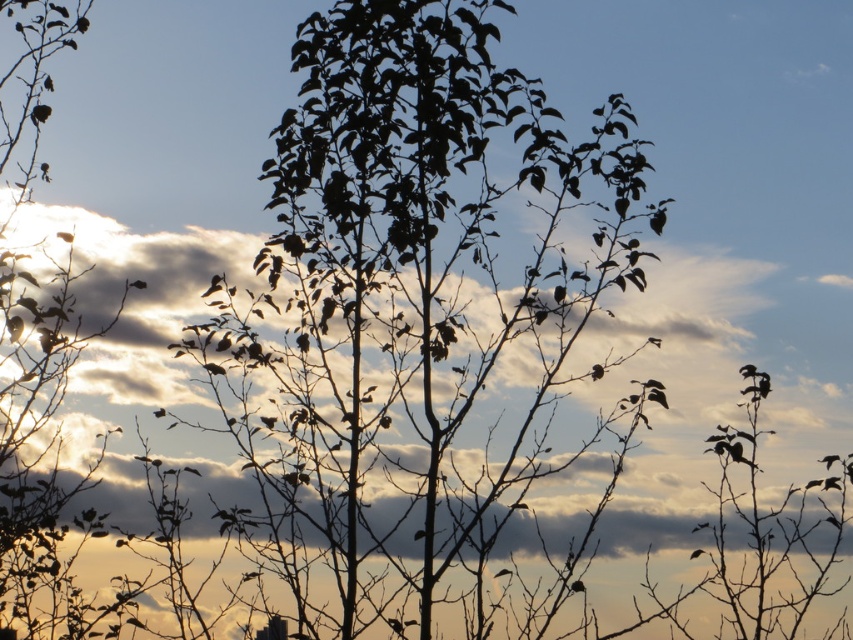
Question: Which of the following is the closest to the observer?

Choices:
 (A) silhouette leafy tree at center
 (B) white fluffy cloud at upper center

Answer: (A)

Question: Which of the following is the closest to the observer?

Choices:
 (A) white fluffy cloud at upper center
 (B) silhouette leafy tree at center

Answer: (B)

Question: Which point appears closest to the camera in this image?

Choices:
 (A) (674, 358)
 (B) (614, 177)

Answer: (B)

Question: Can you confirm if silhouette leafy tree at center is positioned above white fluffy cloud at upper center?

Choices:
 (A) yes
 (B) no

Answer: (A)

Question: Is silhouette leafy tree at center thinner than white fluffy cloud at upper center?

Choices:
 (A) yes
 (B) no

Answer: (B)

Question: Can you confirm if silhouette leafy tree at center is wider than white fluffy cloud at upper center?

Choices:
 (A) yes
 (B) no

Answer: (A)